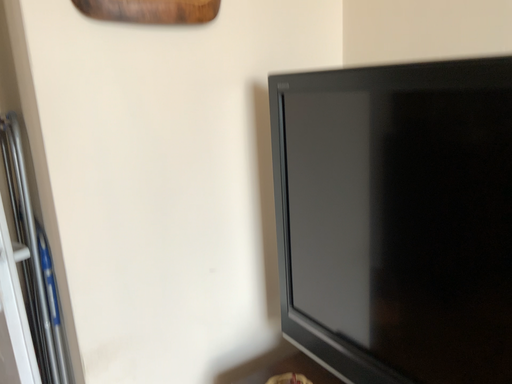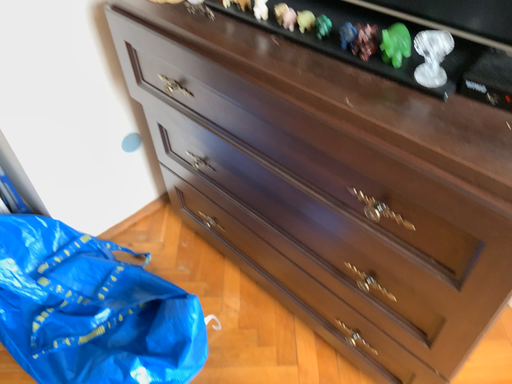
Question: Which way did the camera rotate in the video?

Choices:
 (A) rotated downward
 (B) rotated upward

Answer: (A)